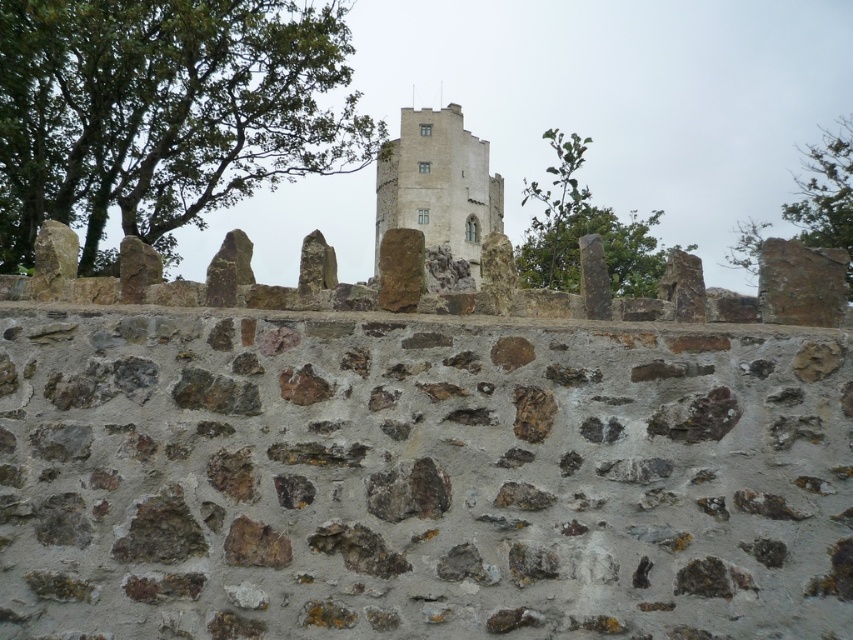
Question: Can you confirm if stone tower at center is smaller than green leafy tree at upper right?

Choices:
 (A) yes
 (B) no

Answer: (A)

Question: Among these points, which one is farthest from the camera?

Choices:
 (A) (805, 160)
 (B) (334, 77)

Answer: (A)

Question: Which point is farther to the camera?

Choices:
 (A) green leafy tree at upper center
 (B) green leafy tree at upper right

Answer: (A)

Question: Does green leafy tree at upper left appear under green leafy tree at upper center?

Choices:
 (A) yes
 (B) no

Answer: (B)

Question: Does stone tower at center appear on the right side of green leafy tree at upper right?

Choices:
 (A) no
 (B) yes

Answer: (A)

Question: Which point appears farthest from the camera in this image?

Choices:
 (A) (849, 177)
 (B) (112, 81)

Answer: (A)